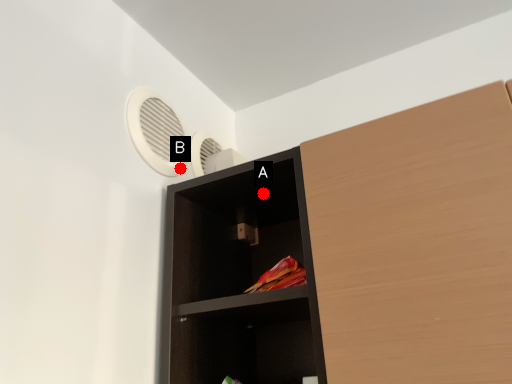
Question: Two points are circled on the image, labeled by A and B beside each circle. Among these points, which one is farthest from the camera?

Choices:
 (A) A is further
 (B) B is further

Answer: (B)